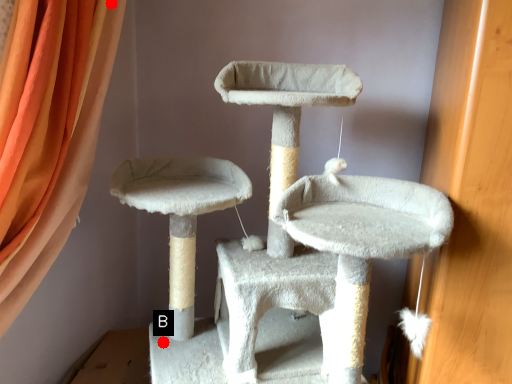
Question: Two points are circled on the image, labeled by A and B beside each circle. Which point is closer to the camera?

Choices:
 (A) A is closer
 (B) B is closer

Answer: (A)